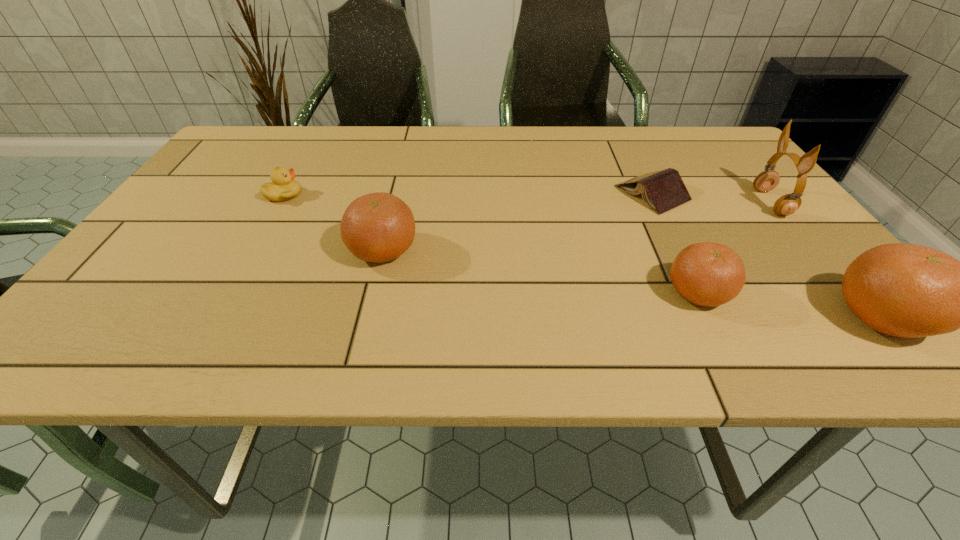
In the image, there is a desktop. Where is `vacant space at the far left corner`? This screenshot has width=960, height=540. vacant space at the far left corner is located at coordinates (236, 158).

Find the location of a particular element. vacant space at the far right corner is located at coordinates (731, 154).

Image resolution: width=960 pixels, height=540 pixels. I want to click on free space between the book and the earphone, so (x=711, y=198).

Locate an element on the screen. vacant space in between the earphone and the shortest object is located at coordinates (711, 198).

I want to click on free space between the leftmost object and the book, so click(468, 194).

Locate an element on the screen. vacant point located between the fourth shortest object and the tallest object is located at coordinates (577, 226).

The width and height of the screenshot is (960, 540). Find the location of `object that is the second closest to the duckling`. object that is the second closest to the duckling is located at coordinates (663, 190).

Where is `object that stands as the second closest to the second shortest clementine`? The height and width of the screenshot is (540, 960). object that stands as the second closest to the second shortest clementine is located at coordinates (663, 190).

Identify which clementine is located as the third nearest to the shortest object. Please provide its 2D coordinates. Your answer should be formatted as a tuple, i.e. [(x, y)], where the tuple contains the x and y coordinates of a point satisfying the conditions above.

[(379, 227)]

This screenshot has width=960, height=540. I want to click on clementine identified as the third closest to the leftmost object, so click(904, 290).